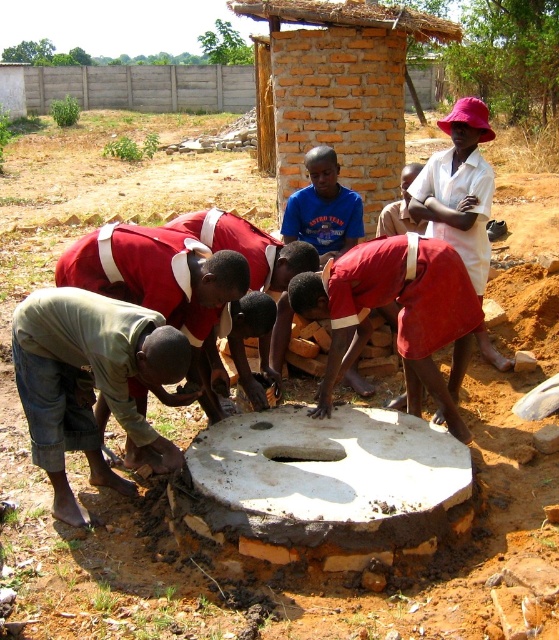
Looking at this image, does red fabric shirt at center appear under light brown wooden stick at center?

Correct, red fabric shirt at center is located below light brown wooden stick at center.

Is red fabric shirt at center closer to camera compared to light brown wooden stick at center?

Yes, red fabric shirt at center is closer to the viewer.

Locate an element on the screen. Image resolution: width=559 pixels, height=640 pixels. red fabric shirt at center is located at coordinates (399, 314).

The width and height of the screenshot is (559, 640). I want to click on red fabric shirt at center, so click(399, 314).

Between point (329, 195) and point (387, 234), which one is positioned behind?

The point (387, 234) is more distant.

Between point (316, 163) and point (392, 234), which one is positioned in front?

Point (316, 163)

Which is in front, point (352, 241) or point (401, 212)?

Positioned in front is point (352, 241).

Find the location of a particular element. blue t-shirt at center is located at coordinates (324, 209).

Looking at this image, can you confirm if red fabric shirt at center is positioned below green fabric shirt at lower left?

Indeed, red fabric shirt at center is positioned under green fabric shirt at lower left.

Which of these two, red fabric shirt at center or green fabric shirt at lower left, stands shorter?

green fabric shirt at lower left

Locate an element on the screen. This screenshot has height=640, width=559. red fabric shirt at center is located at coordinates (399, 314).

Where is `red fabric shirt at center`? The image size is (559, 640). red fabric shirt at center is located at coordinates (399, 314).